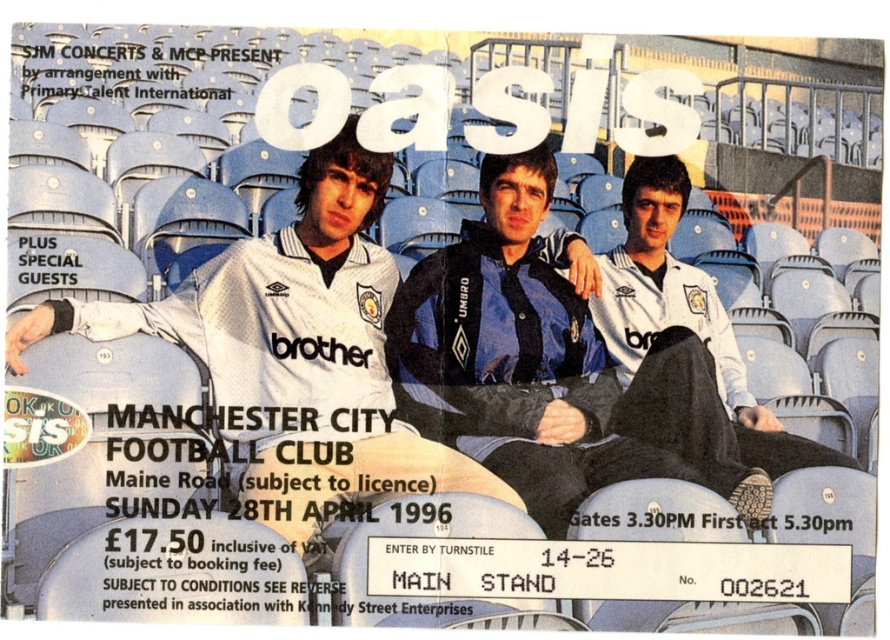
Is point (452, 307) farther from camera compared to point (324, 196)?

Yes, point (452, 307) is farther from viewer.

Looking at this image, is blue jersey at center to the right of white jersey at center from the viewer's perspective?

Indeed, blue jersey at center is positioned on the right side of white jersey at center.

Measure the distance between blue jersey at center and camera.

A distance of 61.66 feet exists between blue jersey at center and camera.

Locate an element on the screen. blue jersey at center is located at coordinates (557, 371).